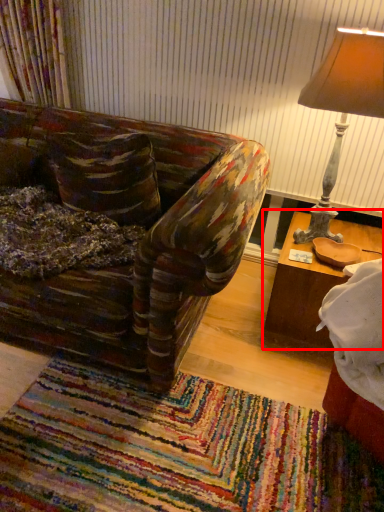
Question: From the image's perspective, what is the correct spatial relationship of table (annotated by the red box) in relation to lamp?

Choices:
 (A) above
 (B) below

Answer: (B)